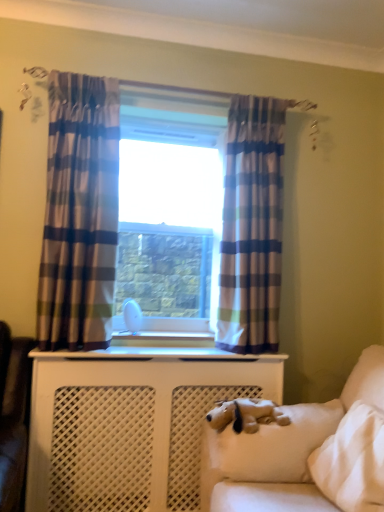
Question: Does white soft pillow at lower right have a lesser height compared to white plush dog at lower right?

Choices:
 (A) yes
 (B) no

Answer: (A)

Question: From the image's perspective, is white soft pillow at lower right beneath white plush dog at lower right?

Choices:
 (A) no
 (B) yes

Answer: (A)

Question: Does white soft pillow at lower right appear on the left side of white plush dog at lower right?

Choices:
 (A) no
 (B) yes

Answer: (A)

Question: From a real-world perspective, is white soft pillow at lower right physically above white plush dog at lower right?

Choices:
 (A) no
 (B) yes

Answer: (B)

Question: Is white soft pillow at lower right further to camera compared to white plush dog at lower right?

Choices:
 (A) no
 (B) yes

Answer: (A)

Question: Does white soft pillow at lower right contain white plush dog at lower right?

Choices:
 (A) no
 (B) yes

Answer: (A)

Question: Considering the relative sizes of white glossy radiator at center and white plush dog at lower right in the image provided, is white glossy radiator at center bigger than white plush dog at lower right?

Choices:
 (A) yes
 (B) no

Answer: (B)

Question: Does white glossy radiator at center have a smaller size compared to white plush dog at lower right?

Choices:
 (A) no
 (B) yes

Answer: (B)

Question: Is white glossy radiator at center positioned behind white plush dog at lower right?

Choices:
 (A) yes
 (B) no

Answer: (A)

Question: From the image's perspective, is white glossy radiator at center beneath white plush dog at lower right?

Choices:
 (A) no
 (B) yes

Answer: (A)

Question: Are white glossy radiator at center and white plush dog at lower right located far from each other?

Choices:
 (A) yes
 (B) no

Answer: (B)

Question: From a real-world perspective, is white glossy radiator at center physically below white plush dog at lower right?

Choices:
 (A) no
 (B) yes

Answer: (A)

Question: Is blue plaid curtain at center, the 1th curtain in the right-to-left sequence, behind white glossy radiator at center?

Choices:
 (A) no
 (B) yes

Answer: (A)